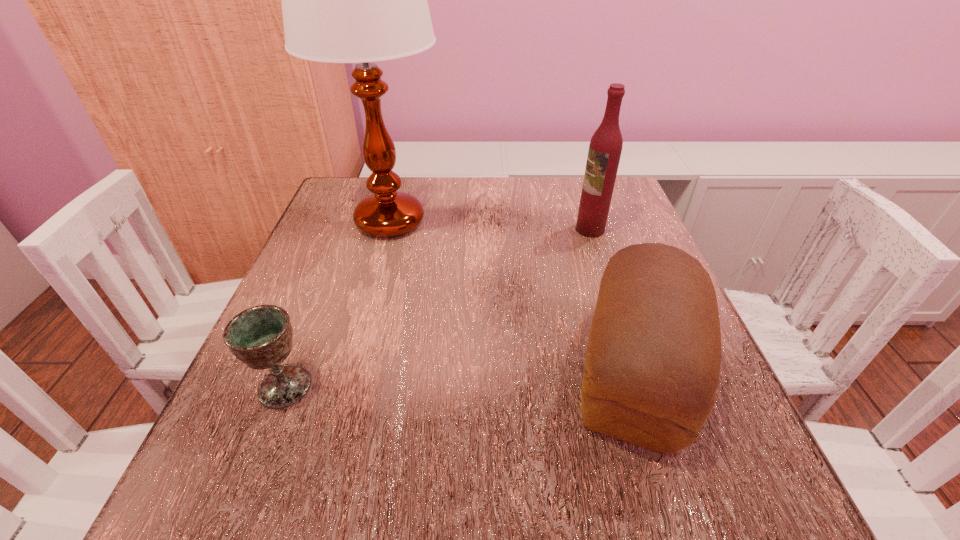
This screenshot has height=540, width=960. In order to click on vacant region at the far edge of the desktop in this screenshot , I will do `click(479, 185)`.

Find the location of a particular element. The image size is (960, 540). free space at the near edge of the desktop is located at coordinates (461, 456).

In the image, there is a desktop. Find the location of `vacant space at the left edge`. vacant space at the left edge is located at coordinates (309, 363).

The height and width of the screenshot is (540, 960). Find the location of `free space at the right edge`. free space at the right edge is located at coordinates (694, 446).

You are a GUI agent. You are given a task and a screenshot of the screen. Output one action in this format:
    pyautogui.click(x=<x>, y=<y>)
    Task: Click on the free space at the far right corner of the desktop
    The width and height of the screenshot is (960, 540).
    Given the screenshot: What is the action you would take?
    pyautogui.click(x=616, y=190)

You are a GUI agent. You are given a task and a screenshot of the screen. Output one action in this format:
    pyautogui.click(x=<x>, y=<y>)
    Task: Click on the vacant space that's between the chalice and the second tallest object
    The height and width of the screenshot is (540, 960).
    Given the screenshot: What is the action you would take?
    pyautogui.click(x=438, y=308)

You are a GUI agent. You are given a task and a screenshot of the screen. Output one action in this format:
    pyautogui.click(x=<x>, y=<y>)
    Task: Click on the vacant point located between the table lamp and the second tallest object
    
    Given the screenshot: What is the action you would take?
    pyautogui.click(x=490, y=225)

Locate an element on the screen. The image size is (960, 540). vacant area that lies between the table lamp and the chalice is located at coordinates (337, 304).

Identify the location of vacant region between the shortest object and the bread. (459, 379).

Locate an element on the screen. free space that is in between the liquor and the chalice is located at coordinates (438, 308).